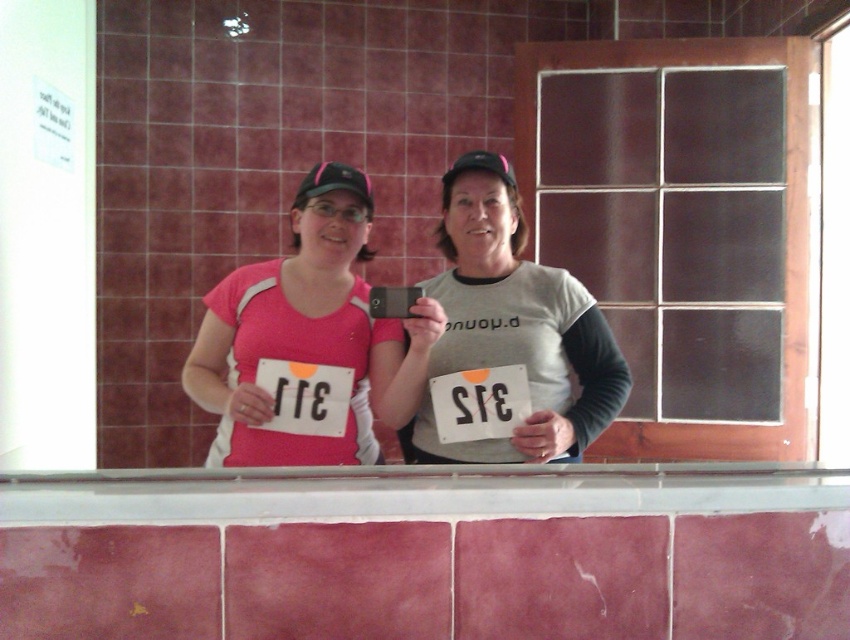
Identify the location of white glossy ledge at center. Image resolution: width=850 pixels, height=640 pixels. (417, 492).

Who is more forward, (442, 497) or (486, 372)?

Point (442, 497)

This screenshot has height=640, width=850. Identify the location of white glossy ledge at center. point(417,492).

Is point (808, 486) farther from camera compared to point (228, 372)?

No, (808, 486) is in front of (228, 372).

What do you see at coordinates (417, 492) in the screenshot? I see `white glossy ledge at center` at bounding box center [417, 492].

Between point (196, 513) and point (361, 336), which one is positioned behind?

Positioned behind is point (361, 336).

At what (x,y) coordinates should I click in order to perform the action: click on white glossy ledge at center. Please return your answer as a coordinate pair (x, y). The width and height of the screenshot is (850, 640). Looking at the image, I should click on (417, 492).

Is matte pink shirt at center smaller than black paper at center?

Incorrect, matte pink shirt at center is not smaller in size than black paper at center.

Which is above, matte pink shirt at center or black paper at center?

matte pink shirt at center is above.

What do you see at coordinates (292, 330) in the screenshot?
I see `matte pink shirt at center` at bounding box center [292, 330].

This screenshot has height=640, width=850. I want to click on matte pink shirt at center, so click(x=292, y=330).